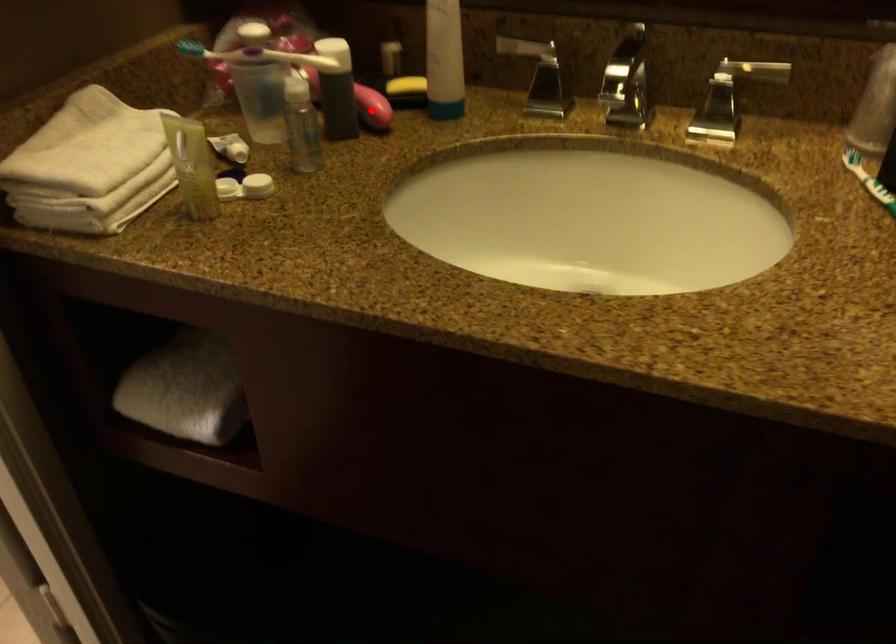
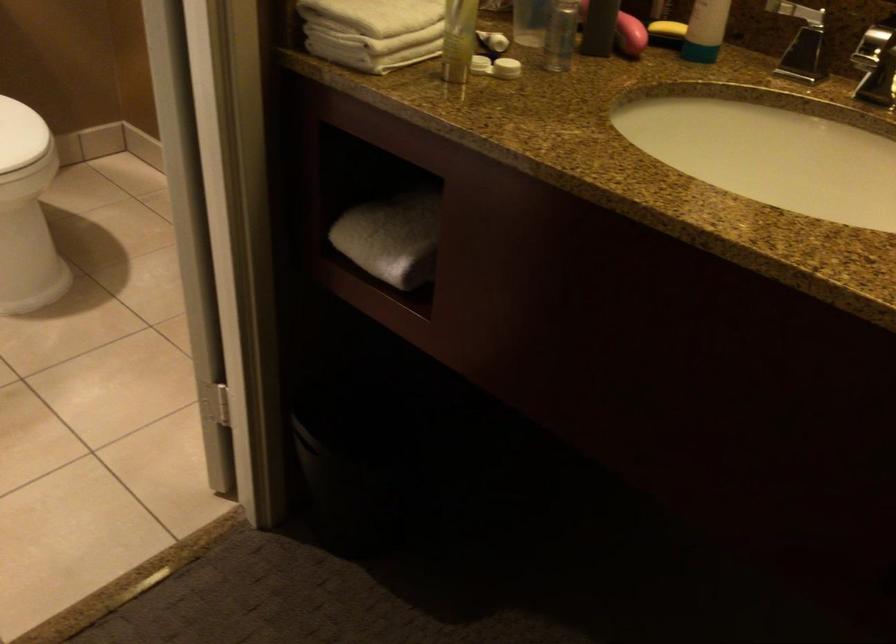
Where in the second image is the point corresponding to the highlighted location from the first image?

(630, 35)